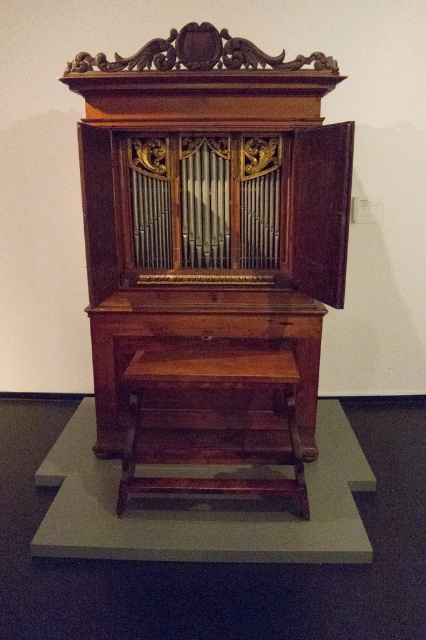
Measure the distance from polished wood pipe organ at center to wooden stool at center.

The distance of polished wood pipe organ at center from wooden stool at center is 15.05 inches.

Is point (141, 316) more distant than point (184, 481)?

Yes, it is behind point (184, 481).

Where is `polished wood pipe organ at center`? polished wood pipe organ at center is located at coordinates (210, 241).

Identify the location of polished wood pipe organ at center. Image resolution: width=426 pixels, height=640 pixels. (210, 241).